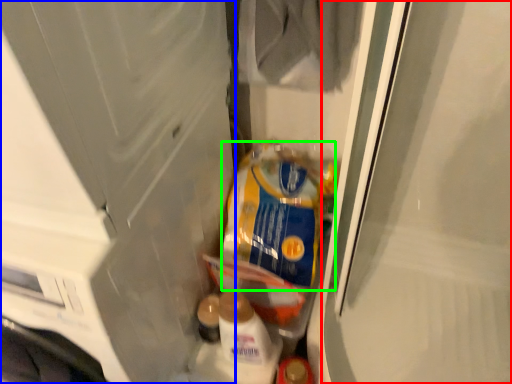
Question: Estimate the real-world distances between objects in this image. Which object is farther from screen door (highlighted by a red box), screen door (highlighted by a blue box) or product (highlighted by a green box)?

Choices:
 (A) screen door
 (B) product

Answer: (A)